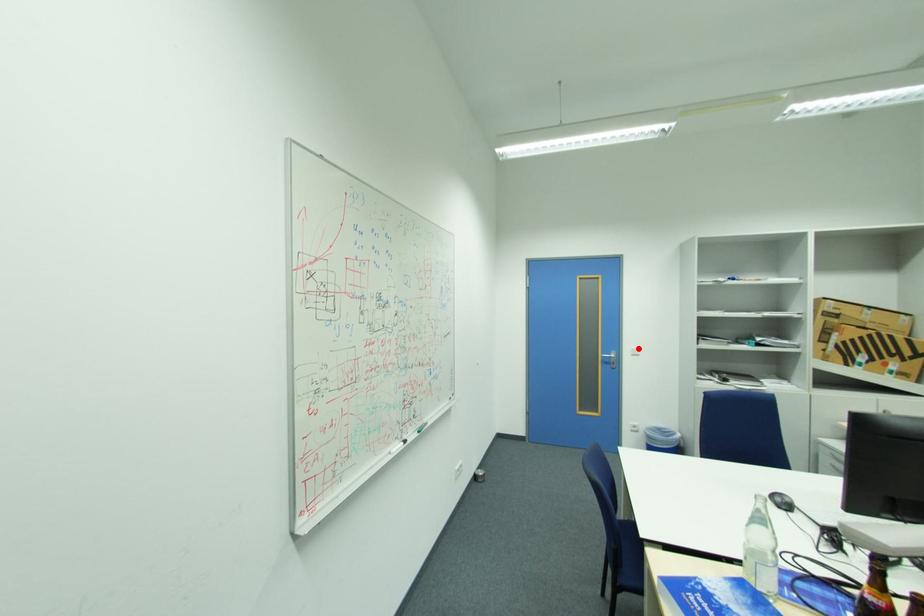
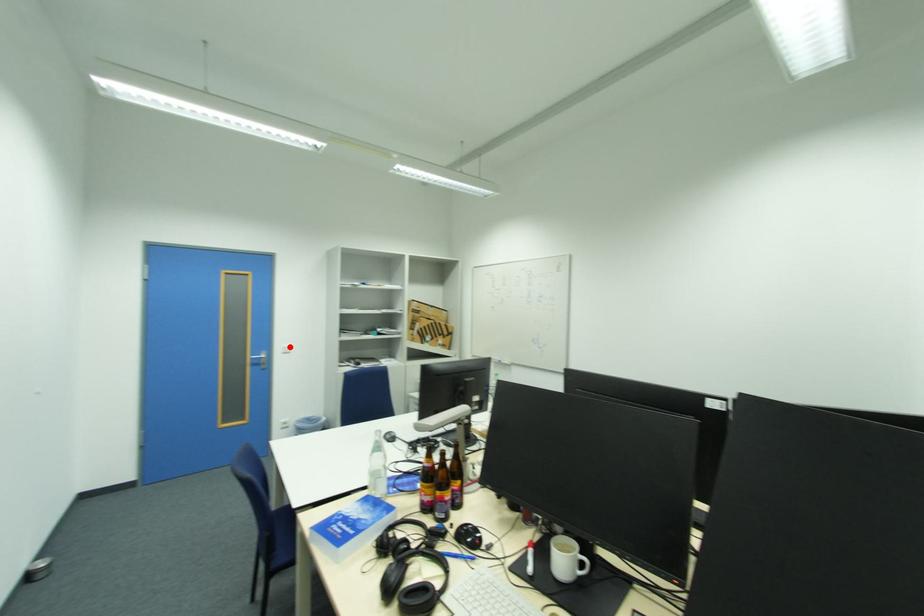
I am providing you with two images of the same scene from different viewpoints. A red point is marked on the first image and another point is marked on the second image. Does the point marked in image1 correspond to the same location as the one in image2?

Yes